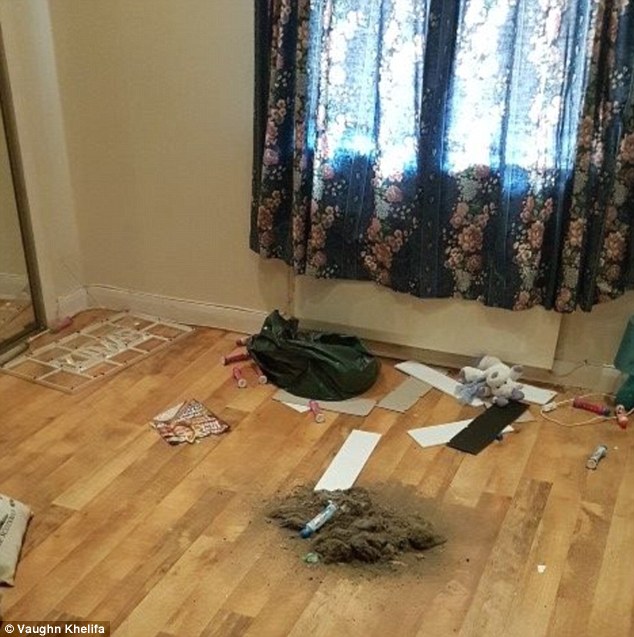
Image resolution: width=634 pixels, height=637 pixels. I want to click on curtains in window, so click(543, 268), click(384, 257).